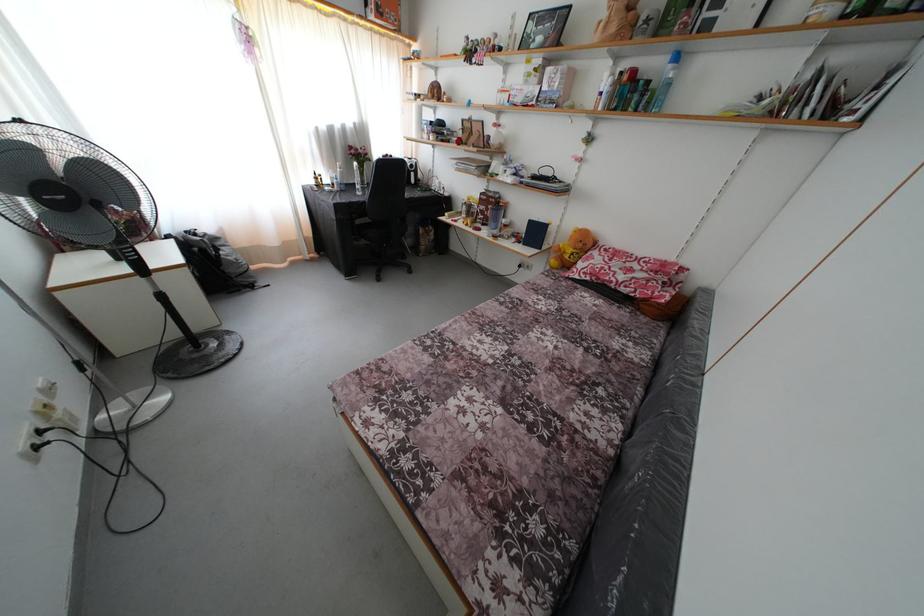
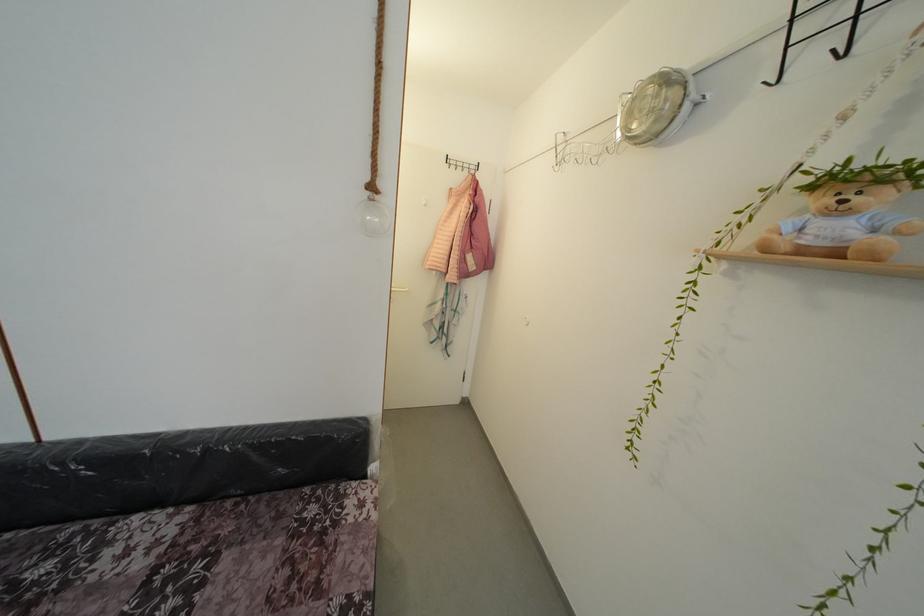
Where in the second image is the point corresponding to pixel 584 408 from the first image?

(99, 585)